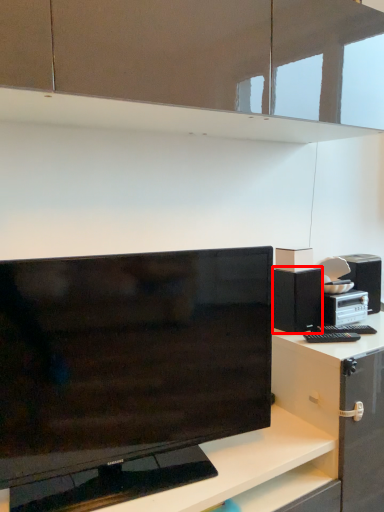
Question: Considering the relative positions of cabinetry (annotated by the red box) and desk in the image provided, where is cabinetry (annotated by the red box) located with respect to the staircase?

Choices:
 (A) left
 (B) right

Answer: (B)